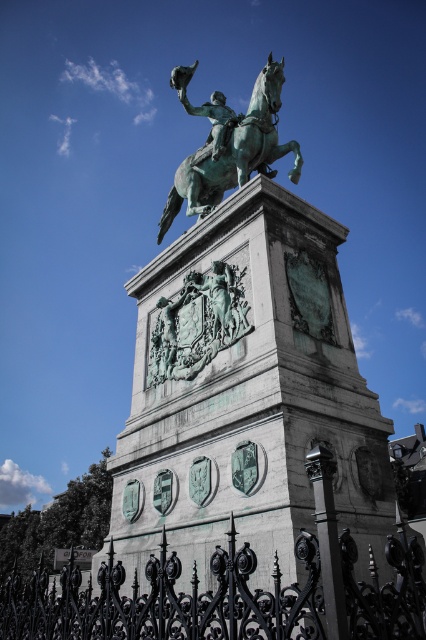
Looking at this image, can you confirm if black wrought iron fence at lower center is positioned below green patina horse at center?

Correct, black wrought iron fence at lower center is located below green patina horse at center.

Consider the image. Who is taller, black wrought iron fence at lower center or green patina horse at center?

With more height is green patina horse at center.

Locate an element on the screen. The width and height of the screenshot is (426, 640). black wrought iron fence at lower center is located at coordinates (166, 600).

Is point (247, 131) in front of point (170, 312)?

No, (247, 131) is further to viewer.

The image size is (426, 640). Describe the element at coordinates (233, 154) in the screenshot. I see `green patina horse at center` at that location.

Does point (176, 196) come behind point (158, 380)?

Yes, point (176, 196) is behind point (158, 380).

Find the location of `green patina horse at center`. green patina horse at center is located at coordinates (233, 154).

Consider the image. Does green patina statue at center have a lesser width compared to green patina horse at center?

Yes.

Which is behind, point (204, 316) or point (249, 168)?

The point (249, 168) is behind.

Does point (158, 352) come closer to viewer compared to point (198, 172)?

Yes, point (158, 352) is closer to viewer.

Locate an element on the screen. This screenshot has height=640, width=426. green patina statue at center is located at coordinates (245, 372).